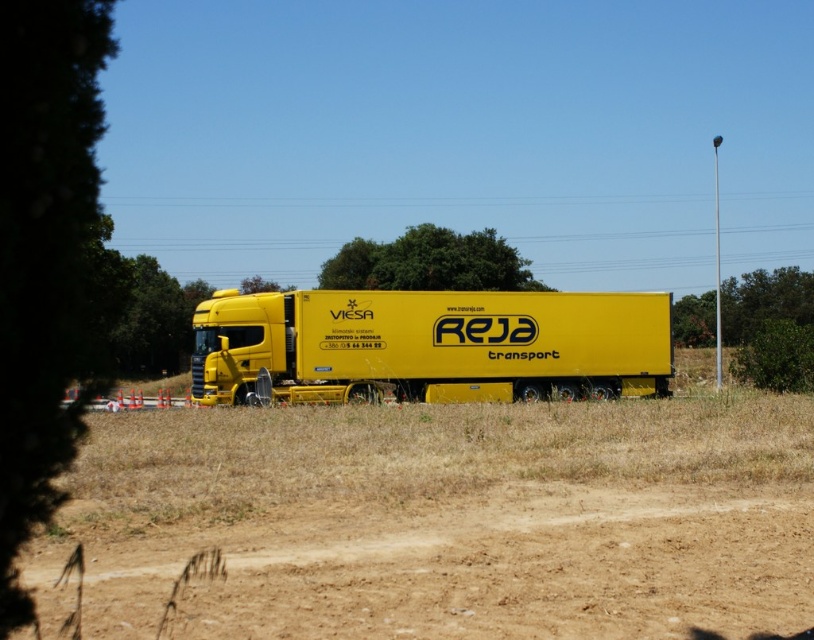
Between dull brown dirt at center and yellow matte trailer truck at center, which one is positioned higher?

yellow matte trailer truck at center

Between point (353, 484) and point (502, 314), which one is positioned behind?

Point (502, 314)

Measure the distance between point (351, 406) and camera.

The distance of point (351, 406) from camera is 28.06 meters.

Where is `dull brown dirt at center`? Image resolution: width=814 pixels, height=640 pixels. dull brown dirt at center is located at coordinates (456, 518).

Does green leafy tree at center appear over green leafy tree at left?

Yes, green leafy tree at center is above green leafy tree at left.

Describe the element at coordinates (429, 262) in the screenshot. I see `green leafy tree at center` at that location.

Who is more forward, (506, 264) or (174, 348)?

Positioned in front is point (506, 264).

Where is `green leafy tree at center`? The width and height of the screenshot is (814, 640). green leafy tree at center is located at coordinates (429, 262).

Does point (469, 481) lie in front of point (471, 262)?

Yes, point (469, 481) is in front of point (471, 262).

Who is higher up, dull brown dirt at center or green leafy tree at center?

green leafy tree at center is above.

Find the location of a particular element. dull brown dirt at center is located at coordinates (456, 518).

Where is `dull brown dirt at center`? This screenshot has height=640, width=814. dull brown dirt at center is located at coordinates (456, 518).